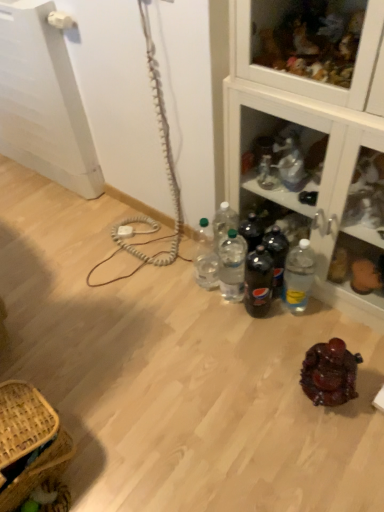
Where is `vacant space situated on the left part of dark glass bottle at center, the 3th bottle positioned from the right`? vacant space situated on the left part of dark glass bottle at center, the 3th bottle positioned from the right is located at coordinates (219, 318).